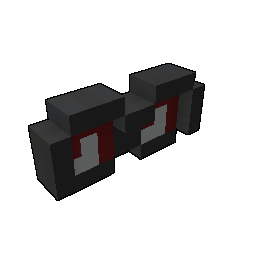
What are the coordinates of `dark red accents` in the screenshot? It's located at (106, 141), (172, 109).